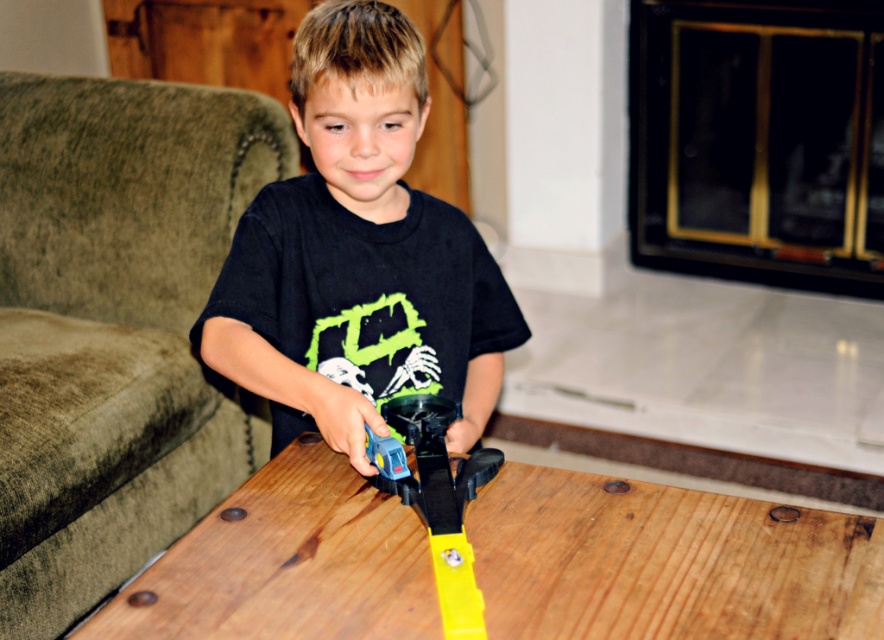
Question: Among these points, which one is nearest to the camera?

Choices:
 (A) (107, 81)
 (B) (462, 602)
 (C) (330, 452)

Answer: (B)

Question: Can you confirm if wooden table at center is smaller than black matte shirt at center?

Choices:
 (A) yes
 (B) no

Answer: (A)

Question: Can you confirm if velvet green couch at left is bigger than black matte shirt at center?

Choices:
 (A) yes
 (B) no

Answer: (A)

Question: Which of these objects is positioned closest to the wooden table at center?

Choices:
 (A) velvet green couch at left
 (B) black matte shirt at center

Answer: (B)

Question: Which point is closer to the camera taking this photo?

Choices:
 (A) (50, 449)
 (B) (356, 620)

Answer: (B)

Question: Does wooden table at center appear over black matte shirt at center?

Choices:
 (A) no
 (B) yes

Answer: (A)